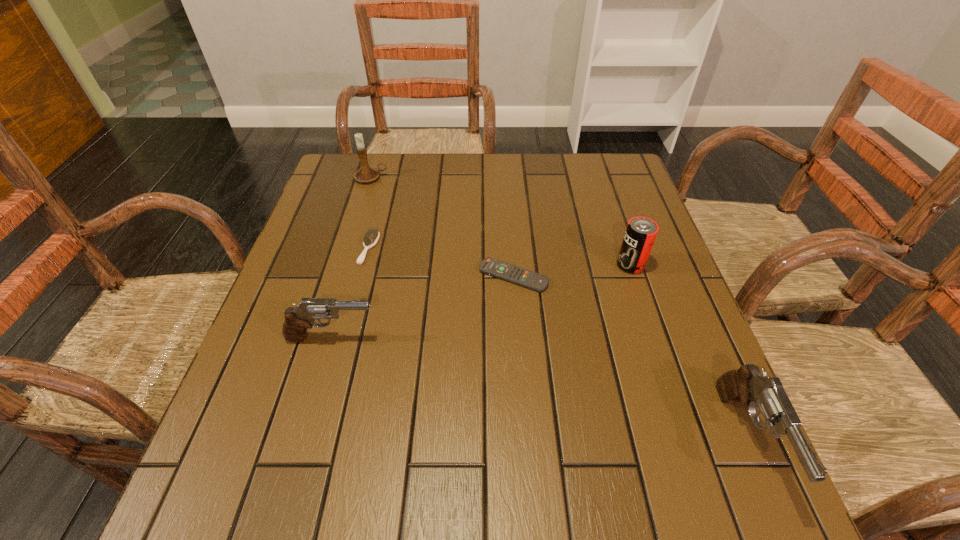
What are the coordinates of `can positioned at the right edge` in the screenshot? It's located at (641, 232).

Where is `object that is at the far left corner`? This screenshot has height=540, width=960. object that is at the far left corner is located at coordinates (366, 174).

The width and height of the screenshot is (960, 540). What are the coordinates of `object that is at the near right corner` in the screenshot? It's located at (746, 385).

Identify the location of vacant region at the far edge of the desktop. This screenshot has height=540, width=960. (529, 160).

This screenshot has width=960, height=540. I want to click on free location at the near edge of the desktop, so click(x=468, y=446).

Where is `free spot at the left edge of the desktop`? The image size is (960, 540). free spot at the left edge of the desktop is located at coordinates (280, 323).

What are the coordinates of `vacant space at the right edge` in the screenshot? It's located at (624, 237).

Where is `free space at the far left corner of the desktop`? Image resolution: width=960 pixels, height=540 pixels. free space at the far left corner of the desktop is located at coordinates (368, 185).

The image size is (960, 540). In the image, there is a desktop. Find the location of `vacant space at the near left corner`. vacant space at the near left corner is located at coordinates (244, 413).

Identify the location of vacant position at the far right corner of the desktop. (582, 165).